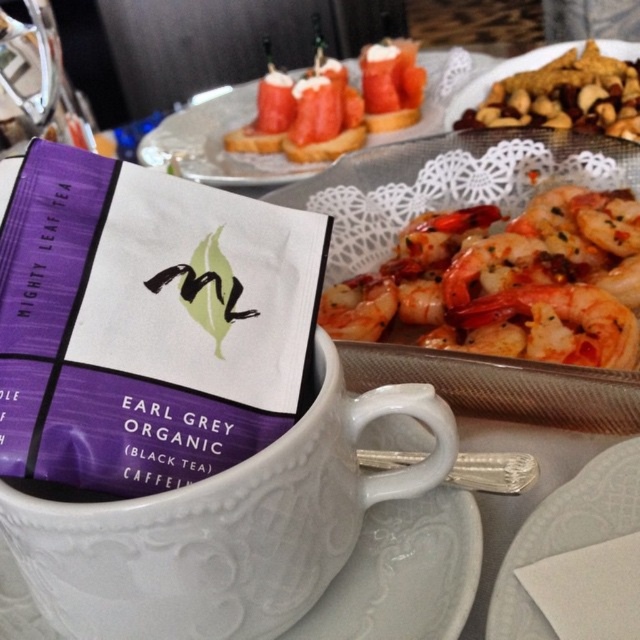
Is point (428, 589) positioned after point (196, 170)?

No, it is in front of (196, 170).

Measure the distance between point (13, 570) and camera.

Point (13, 570) and camera are 17.54 inches apart.

Is point (442, 509) closer to viewer compared to point (204, 152)?

Yes, it is.

At what (x,y) coordinates should I click in order to perform the action: click on white porcelain saucer at center. Please return your answer as a coordinate pair (x, y). The height and width of the screenshot is (640, 640). Looking at the image, I should click on (404, 573).

Does purple paper earl grey tea bag at center have a greater width compared to glossy pinkish-orange shrimp at upper right?

In fact, purple paper earl grey tea bag at center might be narrower than glossy pinkish-orange shrimp at upper right.

Between point (275, 432) and point (588, 310), which one is positioned in front?

Positioned in front is point (275, 432).

Identify the location of purple paper earl grey tea bag at center. Image resolution: width=640 pixels, height=640 pixels. (147, 323).

Can you confirm if golden crunchy nuts at upper right is positioned above smooth salmon at upper center?

No.

Is point (636, 60) farther from camera compared to point (390, 42)?

No, it is in front of (390, 42).

The image size is (640, 640). I want to click on golden crunchy nuts at upper right, so point(557,90).